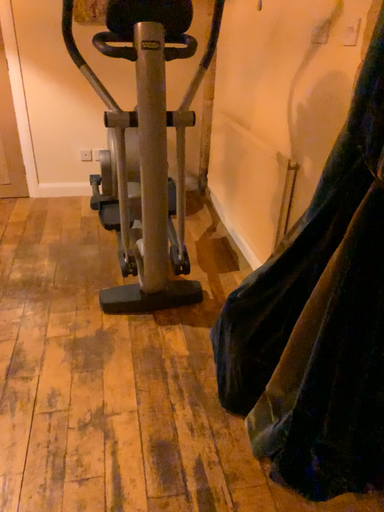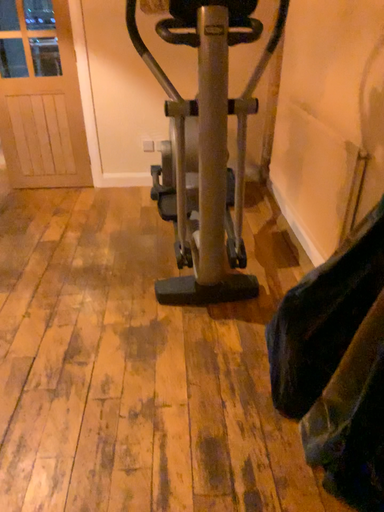
Question: How did the camera likely rotate when shooting the video?

Choices:
 (A) rotated left
 (B) rotated right

Answer: (A)